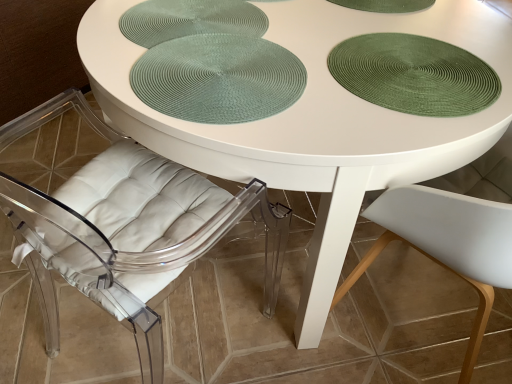
Where is `vacant space behind green textured placemat at upper right, which is the 1th glass plate in right-to-left order`? The width and height of the screenshot is (512, 384). vacant space behind green textured placemat at upper right, which is the 1th glass plate in right-to-left order is located at coordinates (385, 18).